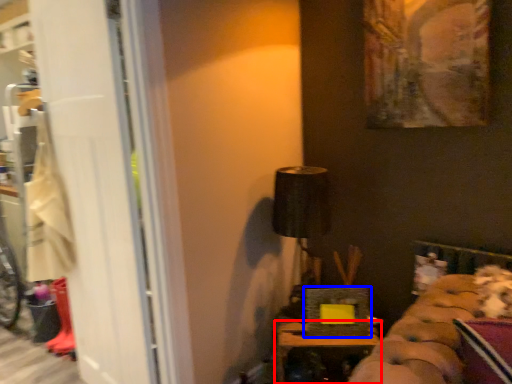
Question: Which object is further to the camera taking this photo, furniture (highlighted by a red box) or picture frame (highlighted by a blue box)?

Choices:
 (A) furniture
 (B) picture frame

Answer: (B)